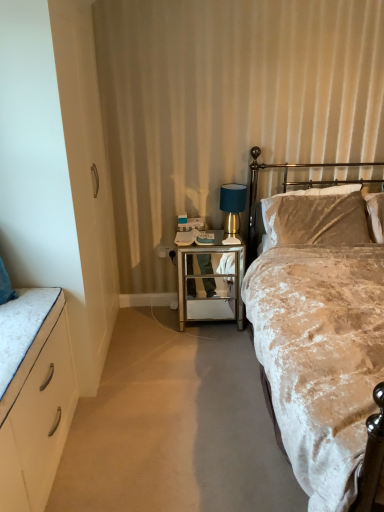
Find the location of a particular element. vacant space to the left of mirrored glass side table at center is located at coordinates (157, 325).